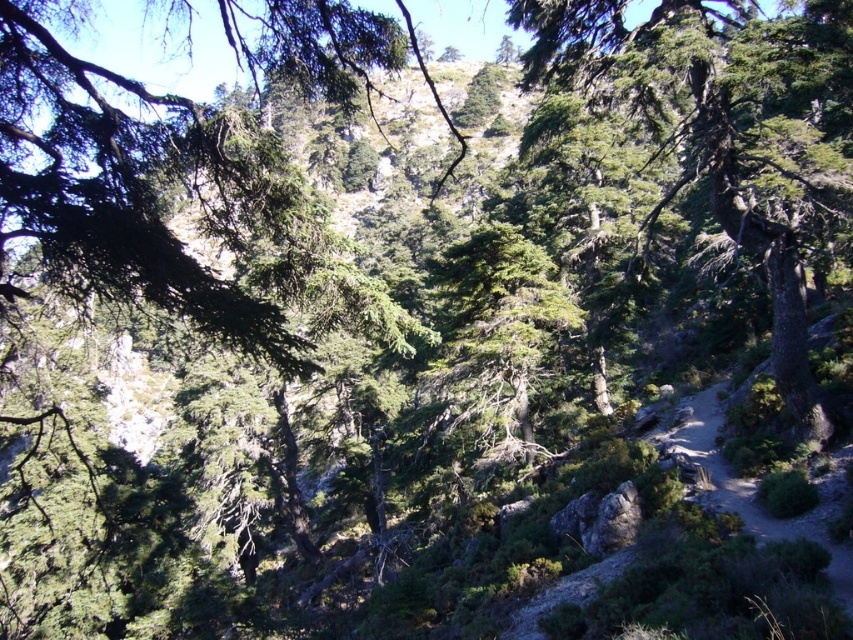
Between green needle-like leaves at upper left and green rough bark tree at center, which one is positioned lower?

Positioned lower is green rough bark tree at center.

Does point (122, 160) come in front of point (543, 17)?

Yes, it is.

Which is behind, point (213, 328) or point (567, 1)?

The point (567, 1) is behind.

At what (x,y) coordinates should I click in order to perform the action: click on green needle-like leaves at upper left. Please return your answer as a coordinate pair (x, y). Looking at the image, I should click on (164, 200).